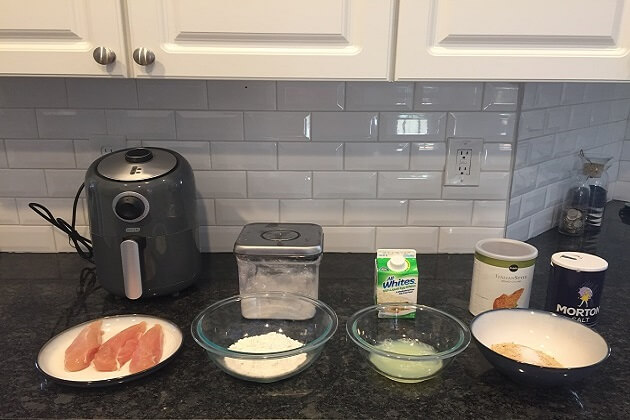
Identify the location of silver knobs. This screenshot has width=630, height=420. (93, 54), (123, 57).